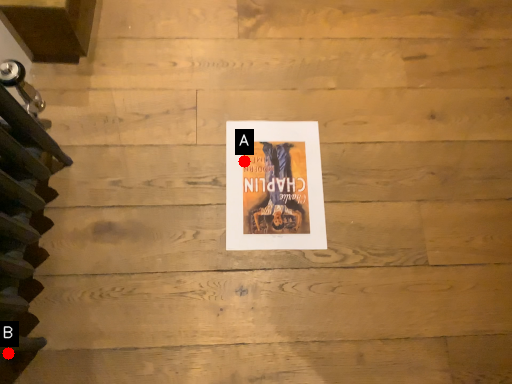
Question: Two points are circled on the image, labeled by A and B beside each circle. Which point appears farthest from the camera in this image?

Choices:
 (A) A is further
 (B) B is further

Answer: (A)